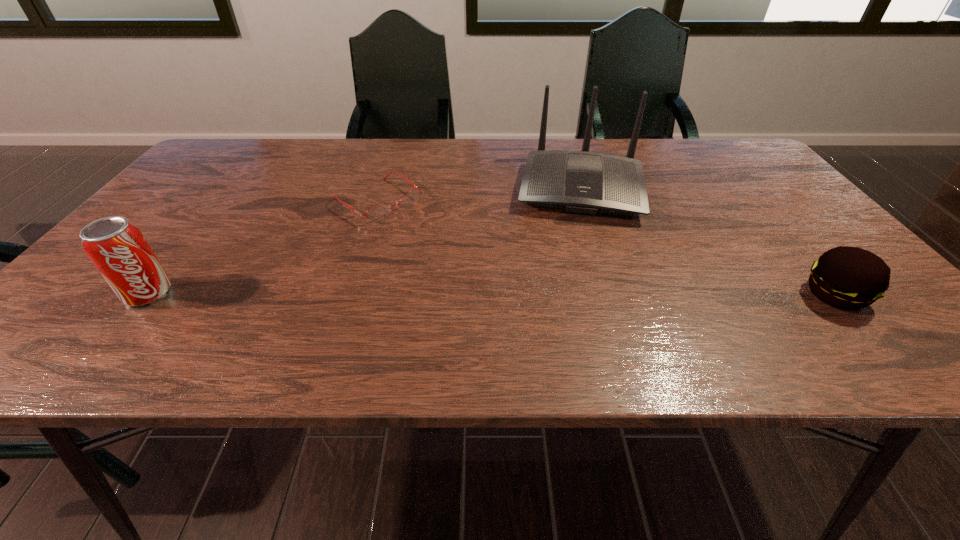
The width and height of the screenshot is (960, 540). I want to click on free region located on the lenses of the shortest object, so click(448, 249).

Identify the location of free space located 0.190m on the lenses of the shortest object. (454, 253).

This screenshot has width=960, height=540. In order to click on vacant space located on the lenses of the shortest object in this screenshot , I will do `click(463, 259)`.

Locate an element on the screen. The height and width of the screenshot is (540, 960). free space located on the front-facing side of the router is located at coordinates (576, 273).

Locate an element on the screen. The image size is (960, 540). vacant space situated 0.270m on the front-facing side of the router is located at coordinates (575, 302).

The image size is (960, 540). I want to click on vacant space located on the front-facing side of the router, so click(x=575, y=295).

What are the coordinates of `object at the far edge` in the screenshot? It's located at (584, 182).

The width and height of the screenshot is (960, 540). Find the location of `soda can at the near edge`. soda can at the near edge is located at coordinates (117, 248).

Locate an element on the screen. The image size is (960, 540). patty positioned at the near edge is located at coordinates click(849, 278).

The height and width of the screenshot is (540, 960). In order to click on object that is at the left edge in this screenshot , I will do `click(117, 248)`.